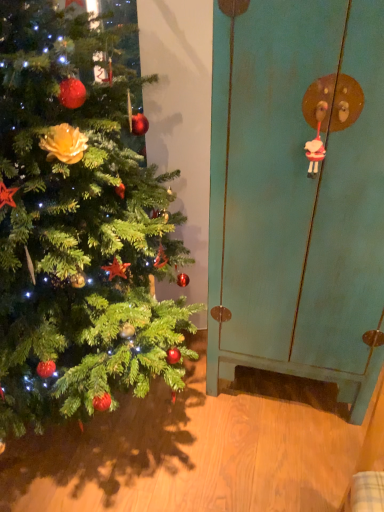
This screenshot has height=512, width=384. Find the location of `space that is in front of teal matte cabinet at right`. space that is in front of teal matte cabinet at right is located at coordinates (272, 458).